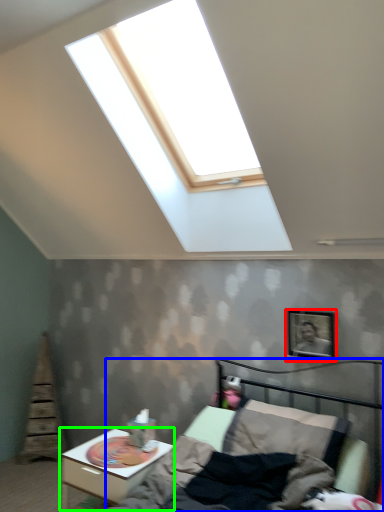
Question: Which object is positioned farthest from picture frame (highlighted by a red box)? Select from bed (highlighted by a blue box) and nightstand (highlighted by a green box).

Choices:
 (A) bed
 (B) nightstand

Answer: (B)